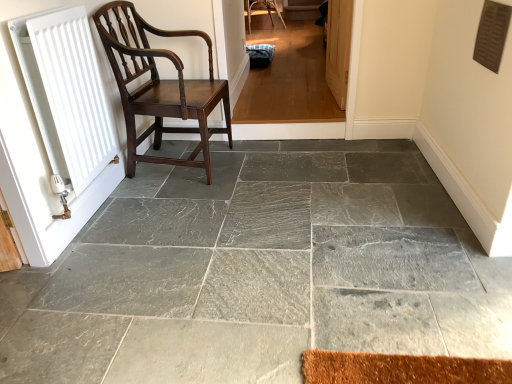
Image resolution: width=512 pixels, height=384 pixels. I want to click on free space to the right of dark wood chair at left, so click(267, 165).